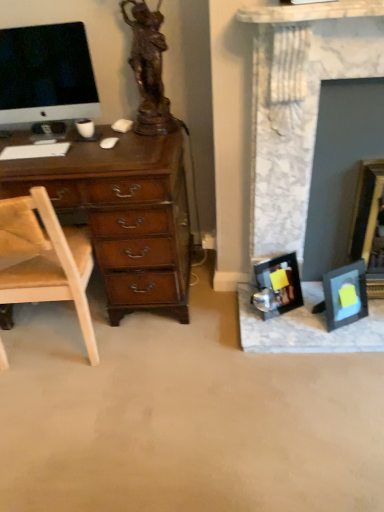
Question: From the image's perspective, does white matte keyboard at left appear higher than marble fireplace at right?

Choices:
 (A) yes
 (B) no

Answer: (A)

Question: Is the position of white matte keyboard at left more distant than that of marble fireplace at right?

Choices:
 (A) no
 (B) yes

Answer: (B)

Question: Is white matte keyboard at left not near marble fireplace at right?

Choices:
 (A) no
 (B) yes

Answer: (A)

Question: Is white matte keyboard at left thinner than marble fireplace at right?

Choices:
 (A) no
 (B) yes

Answer: (B)

Question: From the image's perspective, does white matte keyboard at left appear lower than marble fireplace at right?

Choices:
 (A) yes
 (B) no

Answer: (B)

Question: Considering the relative positions of satin black monitor at upper left and white matte keyboard at left in the image provided, is satin black monitor at upper left to the left or to the right of white matte keyboard at left?

Choices:
 (A) right
 (B) left

Answer: (B)

Question: Relative to white matte keyboard at left, is satin black monitor at upper left in front or behind?

Choices:
 (A) front
 (B) behind

Answer: (A)

Question: Is satin black monitor at upper left taller or shorter than white matte keyboard at left?

Choices:
 (A) tall
 (B) short

Answer: (A)

Question: Which is correct: satin black monitor at upper left is inside white matte keyboard at left, or outside of it?

Choices:
 (A) inside
 (B) outside

Answer: (B)

Question: Based on their positions, is marble fireplace at right located to the left or right of white matte computer mouse at center-left?

Choices:
 (A) left
 (B) right

Answer: (B)

Question: Is marble fireplace at right in front of or behind white matte computer mouse at center-left in the image?

Choices:
 (A) behind
 (B) front

Answer: (B)

Question: From a real-world perspective, is marble fireplace at right physically located above or below white matte computer mouse at center-left?

Choices:
 (A) below
 (B) above

Answer: (A)

Question: From the image's perspective, relative to white matte computer mouse at center-left, is marble fireplace at right above or below?

Choices:
 (A) above
 (B) below

Answer: (B)

Question: Looking at their shapes, would you say white matte computer mouse at center-left is wider or thinner than bronze statue at upper left?

Choices:
 (A) wide
 (B) thin

Answer: (B)

Question: In the image, is white matte computer mouse at center-left positioned in front of or behind bronze statue at upper left?

Choices:
 (A) front
 (B) behind

Answer: (B)